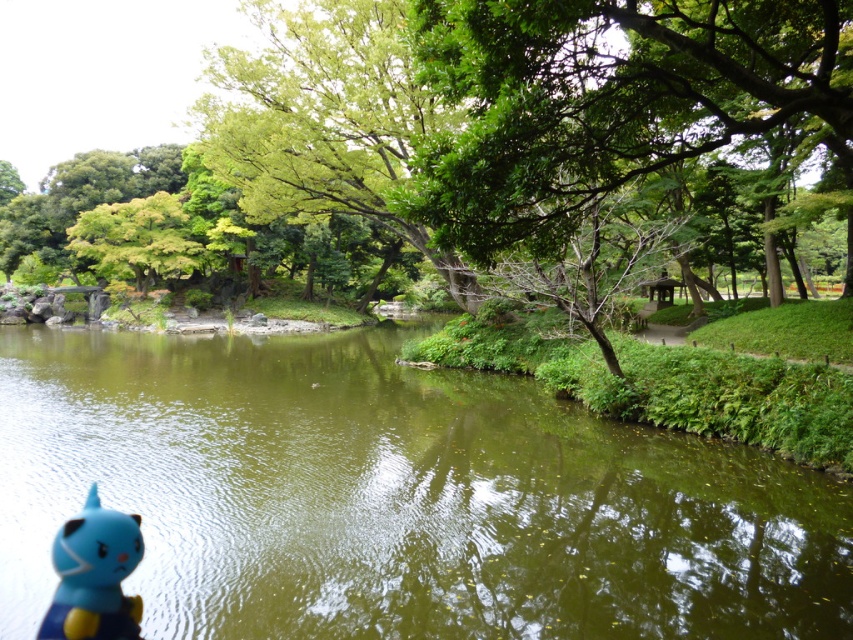
You are standing at the point marked as point (396, 497) in the park scene. What object is located exactly at that point?

The green glossy water at center is located exactly at point (396, 497).

You are a child looking for your lost blue matte toy at lower left in the park. You see the green leafy tree at upper left. Which direction should you look relative to the tree to find the toy?

The blue matte toy at lower left is located below the green leafy tree at upper left, so you should look downward or below the tree to find the toy.